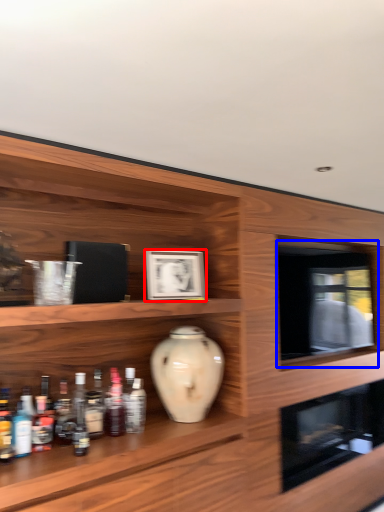
Question: Which object is further to the camera taking this photo, picture frame (highlighted by a red box) or oven (highlighted by a blue box)?

Choices:
 (A) picture frame
 (B) oven

Answer: (B)